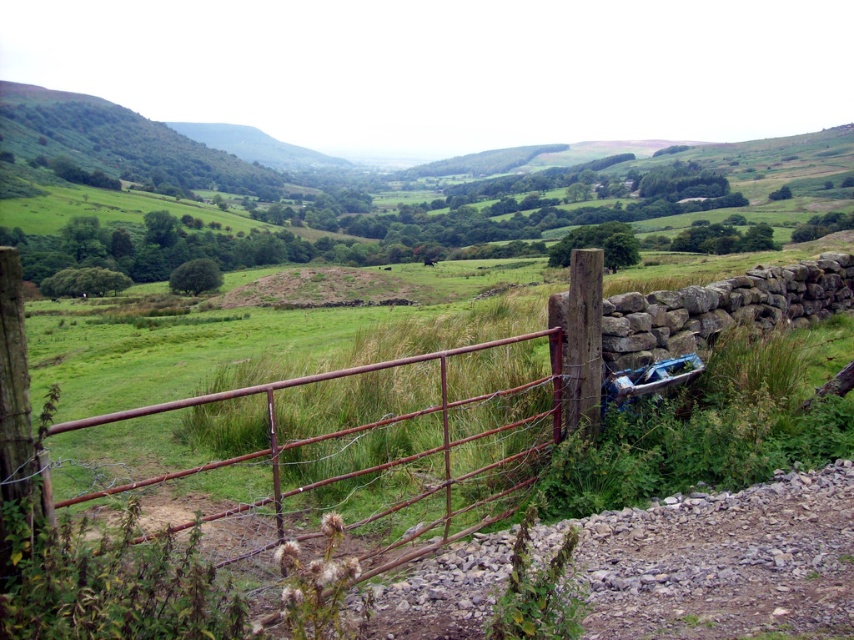
You are driving a metallic blue car at right and want to exit through the rusty metal gate at center. Can you pass through the gate while keeping the car entirely inside the gate opening?

The rusty metal gate at center is in front of the metallic blue car at right, so the car can pass through the gate opening as long as it stays within the gate dimensions.